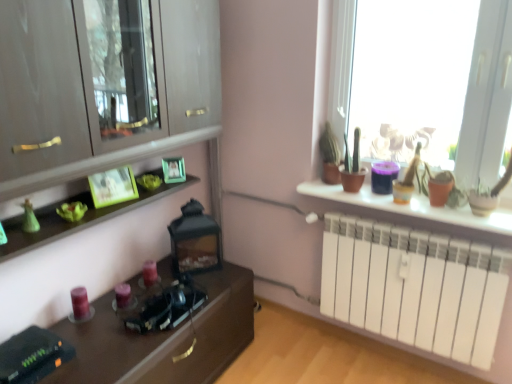
Question: From the image's perspective, is matte green picture frame at center, the 2th picture frame when ordered from front to back, above or below translucent glass window at upper right?

Choices:
 (A) above
 (B) below

Answer: (B)

Question: From their relative heights in the image, would you say matte green picture frame at center, the 2th picture frame when ordered from front to back, is taller or shorter than translucent glass window at upper right?

Choices:
 (A) tall
 (B) short

Answer: (B)

Question: Considering the real-world distances, which object is closest to the white matte radiator at right?

Choices:
 (A) matte purple candle at lower left, which is the second candle from right to left
 (B) matte wood cabinet at left
 (C) matte white radiator at right
 (D) matte purple candle at lower left, which is the 2th candle from left to right
 (E) matte green picture frame at center, the first picture frame positioned from the right

Answer: (C)

Question: Considering the real-world distances, which object is farthest from the matte wood cabinet at left?

Choices:
 (A) green matte picture frame at upper left, which appears as the first picture frame when viewed from the front
 (B) matte green picture frame at center, the 2th picture frame viewed from the left
 (C) matte purple candle at lower left, which is the first candle from left to right
 (D) white matte radiator at right
 (E) matte white radiator at right

Answer: (D)